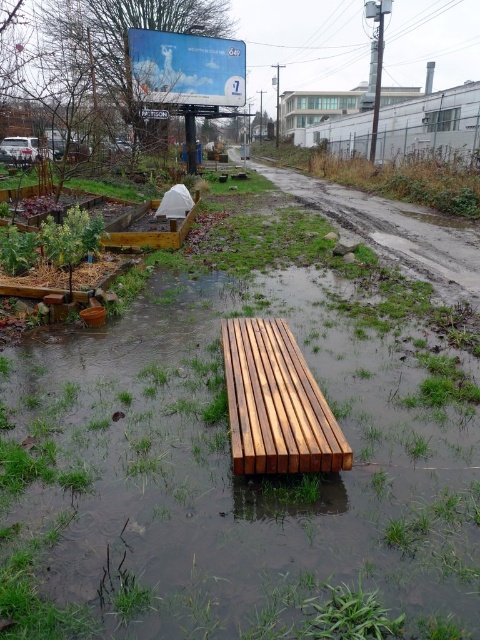
In the scene shown: Can you confirm if wooden bench at center is positioned above matte blue billboard at upper center?

No, wooden bench at center is not above matte blue billboard at upper center.

Does wooden bench at center have a greater width compared to matte blue billboard at upper center?

No, wooden bench at center is not wider than matte blue billboard at upper center.

Describe the element at coordinates (248, 481) in the screenshot. This screenshot has height=640, width=480. I see `wooden bench at center` at that location.

This screenshot has width=480, height=640. I want to click on wooden bench at center, so click(248, 481).

Which is more to the right, light brown wooden bench at center or matte blue billboard at upper center?

light brown wooden bench at center is more to the right.

Does light brown wooden bench at center appear under matte blue billboard at upper center?

Yes, light brown wooden bench at center is below matte blue billboard at upper center.

This screenshot has height=640, width=480. I want to click on light brown wooden bench at center, so click(x=276, y=403).

Identify the location of light brown wooden bench at center. This screenshot has height=640, width=480. (276, 403).

From the picture: Between wooden bench at center and light brown wooden bench at center, which one has less height?

With less height is light brown wooden bench at center.

Is wooden bench at center positioned behind light brown wooden bench at center?

No.

Is point (467, 442) positioned behind point (225, 365)?

That is False.

Identify the location of wooden bench at center. The image size is (480, 640). (248, 481).